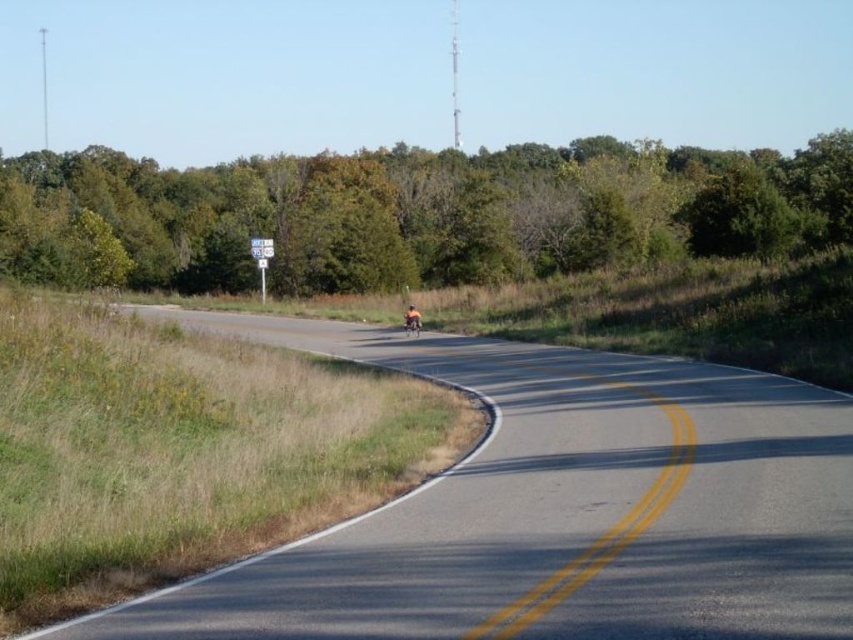
Is green leafy trees at upper center closer to the viewer compared to shiny chrome motorbike at center?

That is False.

Which is behind, point (515, 212) or point (409, 323)?

Point (515, 212)

Find the location of a particular element. This screenshot has height=640, width=853. green leafy trees at upper center is located at coordinates tap(419, 212).

Locate an element on the screen. Image resolution: width=853 pixels, height=640 pixels. green leafy trees at upper center is located at coordinates (419, 212).

Is green leafy trees at upper center to the left of orange fabric motorcyclist at center from the viewer's perspective?

Yes, green leafy trees at upper center is to the left of orange fabric motorcyclist at center.

Between green leafy trees at upper center and orange fabric motorcyclist at center, which one has more height?

With more height is green leafy trees at upper center.

What do you see at coordinates (419, 212) in the screenshot? The height and width of the screenshot is (640, 853). I see `green leafy trees at upper center` at bounding box center [419, 212].

Identify the location of green leafy trees at upper center. This screenshot has height=640, width=853. (419, 212).

Can you confirm if asphalt road at center is bigger than shiny chrome motorbike at center?

Yes, asphalt road at center is bigger than shiny chrome motorbike at center.

Between point (672, 616) and point (412, 320), which one is positioned behind?

Positioned behind is point (412, 320).

At what (x,y) coordinates should I click in order to perform the action: click on asphalt road at center. Please return your answer as a coordinate pair (x, y). Looking at the image, I should click on 554,509.